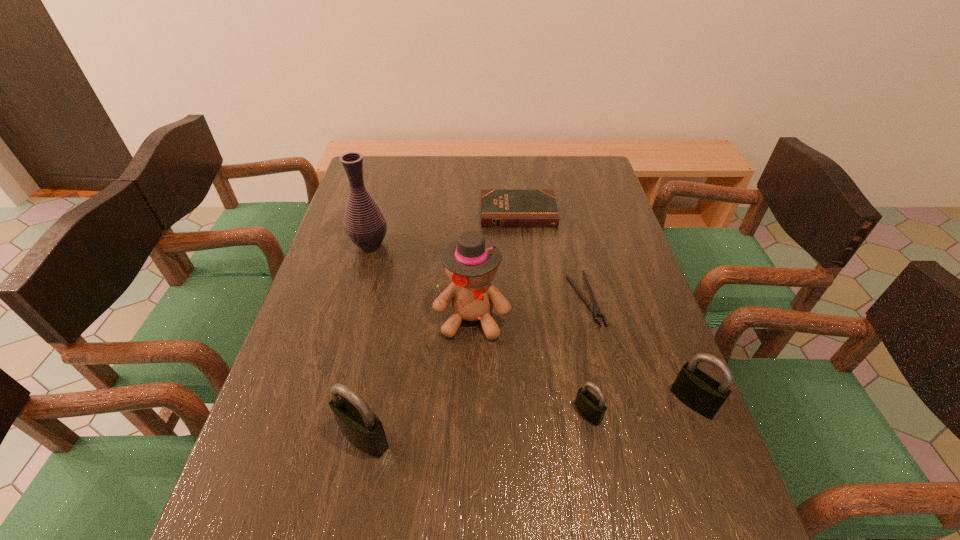
At what (x,y) coordinates should I click in order to perform the action: click on the leftmost padlock. Please return your answer as a coordinate pair (x, y). Image resolution: width=960 pixels, height=540 pixels. Looking at the image, I should click on (360, 426).

The height and width of the screenshot is (540, 960). I want to click on the second padlock from left to right, so 593,409.

Where is `the third shortest object`? The image size is (960, 540). the third shortest object is located at coordinates (593, 409).

You are a GUI agent. You are given a task and a screenshot of the screen. Output one action in this format:
    pyautogui.click(x=<x>, y=<y>)
    Task: Click on the rightmost object
    The image size is (960, 540).
    Given the screenshot: What is the action you would take?
    700,392

This screenshot has width=960, height=540. Identify the location of the second tallest padlock. (700, 392).

Locate an element on the screen. the second shortest object is located at coordinates (499, 208).

You are a GUI agent. You are given a task and a screenshot of the screen. Output one action in this format:
    pyautogui.click(x=<x>, y=<y>)
    Task: Click on the farthest object
    
    Given the screenshot: What is the action you would take?
    pyautogui.click(x=499, y=208)

Where is `tongs`? tongs is located at coordinates (596, 311).

Find the location of a particular element. The image size is (960, 540). the second farthest object is located at coordinates (365, 224).

The height and width of the screenshot is (540, 960). In order to click on the tallest object in this screenshot , I will do `click(365, 224)`.